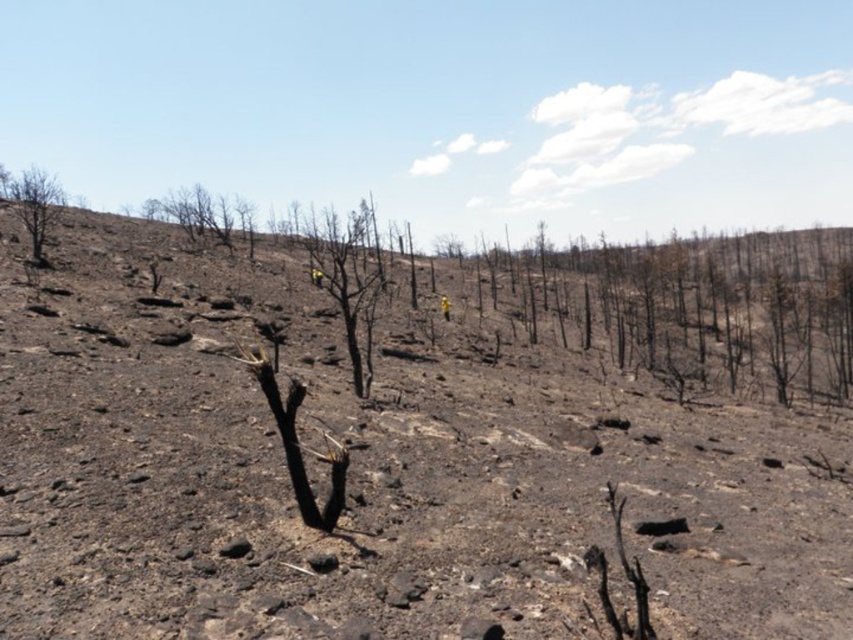
Is charcoal bark tree at center bigger than charcoal-barked tree at upper left?

No, charcoal bark tree at center is not bigger than charcoal-barked tree at upper left.

Between point (352, 248) and point (152, 209), which one is positioned behind?

The point (152, 209) is behind.

Where is `charcoal bark tree at center`? charcoal bark tree at center is located at coordinates (346, 275).

Which is more to the left, charcoal-barked tree at upper left or bare wood tree at upper left?

Positioned to the left is charcoal-barked tree at upper left.

Identify the location of charcoal-barked tree at upper left. This screenshot has height=640, width=853. (204, 216).

Which is above, charcoal bark tree at center or bare wood tree at upper left?

Positioned higher is bare wood tree at upper left.

Between charcoal bark tree at center and bare wood tree at upper left, which one is positioned lower?

charcoal bark tree at center is lower down.

Is point (372, 317) farther from camera compared to point (39, 180)?

No, (372, 317) is closer to viewer.

This screenshot has height=640, width=853. I want to click on charcoal bark tree at center, so click(x=346, y=275).